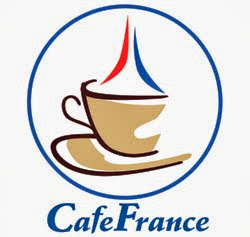
At what (x,y) coordinates should I click in order to perform the action: click on cup handle. Please return your answer as a coordinate pair (x, y). The image size is (250, 237). Looking at the image, I should click on (64, 99).